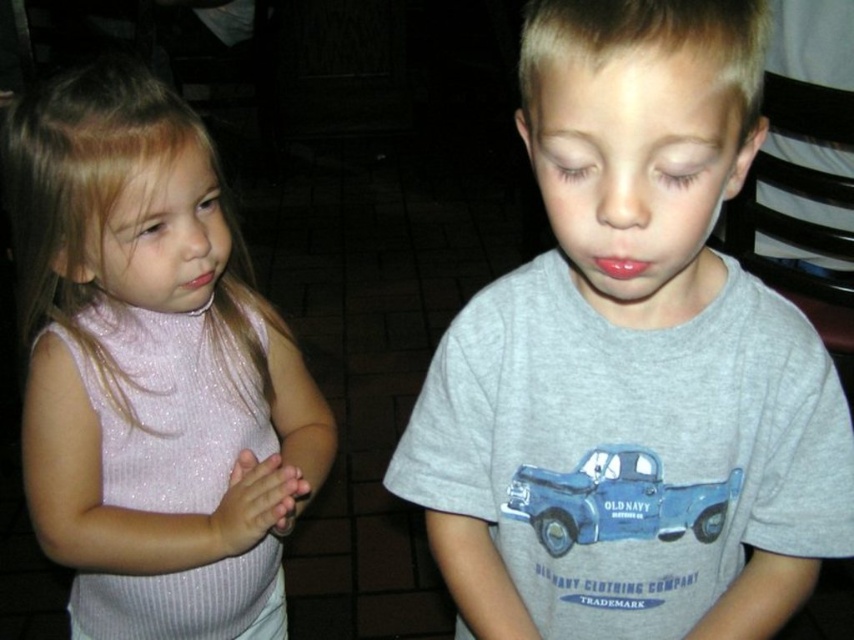
Question: Which point appears farthest from the camera in this image?

Choices:
 (A) (139, 324)
 (B) (651, 460)
 (C) (733, 280)

Answer: (A)

Question: Is gray cotton shirt at center wider than blue matte truck at center?

Choices:
 (A) yes
 (B) no

Answer: (A)

Question: Does pink glittery dress at left lie behind blue matte truck at center?

Choices:
 (A) no
 (B) yes

Answer: (B)

Question: Which object is the farthest from the pink glittery dress at left?

Choices:
 (A) blue matte truck at center
 (B) gray cotton shirt at center

Answer: (A)

Question: Which is nearer to the gray cotton shirt at center?

Choices:
 (A) blue matte truck at center
 (B) pink glittery dress at left

Answer: (A)

Question: Does gray cotton shirt at center have a greater width compared to pink glittery dress at left?

Choices:
 (A) yes
 (B) no

Answer: (B)